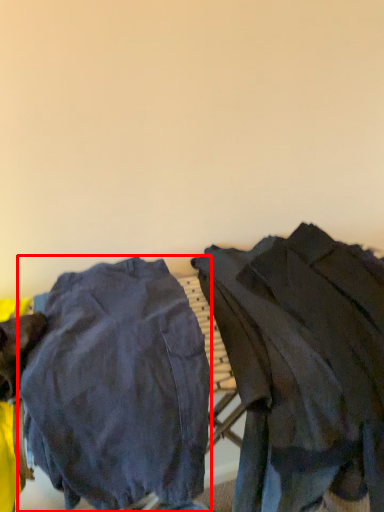
Question: From the image's perspective, considering the relative positions of tight (annotated by the red box) and jacket in the image provided, where is tight (annotated by the red box) located with respect to the staircase?

Choices:
 (A) below
 (B) above

Answer: (A)